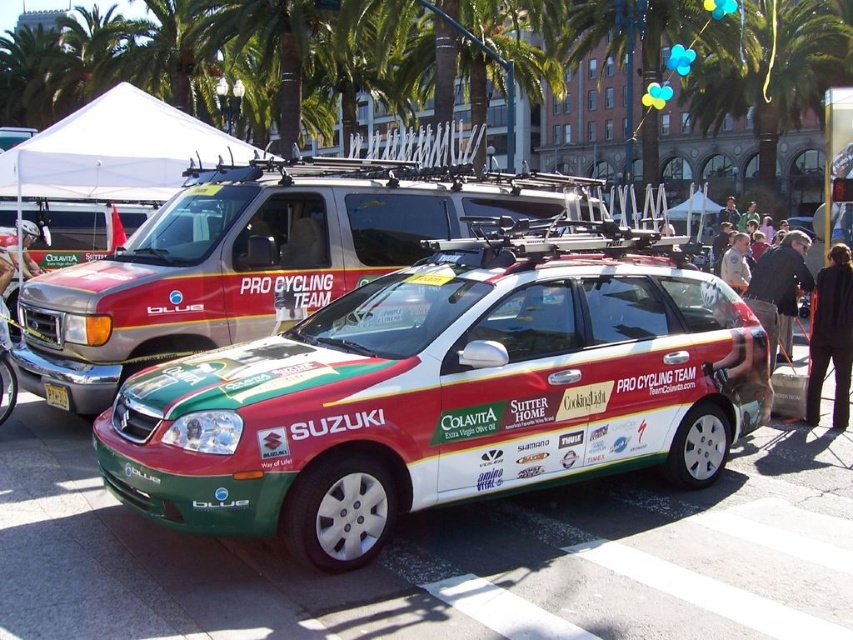
You are standing at the back of the image and want to walk towards the Pro Cycling Team van. Which point, point (207, 346) or point (12, 244), should you aim for to reach the van first?

You should aim for point (12, 244) because it is behind point (207, 346). Since you are at the back of the image, moving towards the point that is closer to you will get you to the van faster.

Looking at this image, you are a photographer at the cycling event. You need to capture a photo that includes both the white fabric canopy at upper center and the dark brown leather jacket at right. Considering their sizes, which object will appear bigger in the final photo?

The white fabric canopy at upper center will appear bigger in the photo because it has a larger size compared to the dark brown leather jacket at right.

You are standing at the point closest to the Pro Cycling Team car. Which point, point (212, 224) or point (141, 116), is closer to you?

Point (212, 224) is in front of point (141, 116), so it is closer to you.